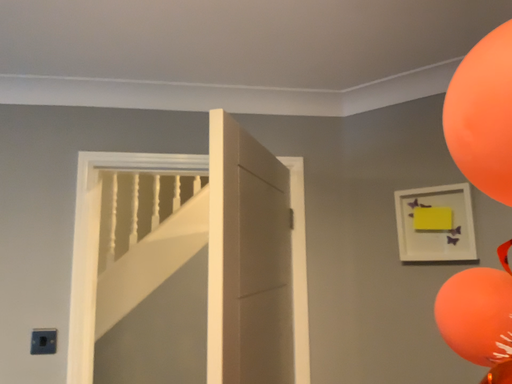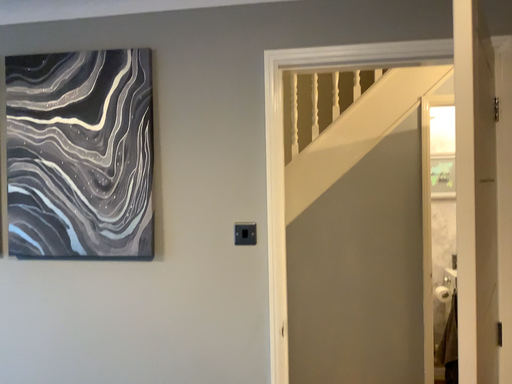
Question: How did the camera likely rotate when shooting the video?

Choices:
 (A) rotated left
 (B) rotated right

Answer: (A)